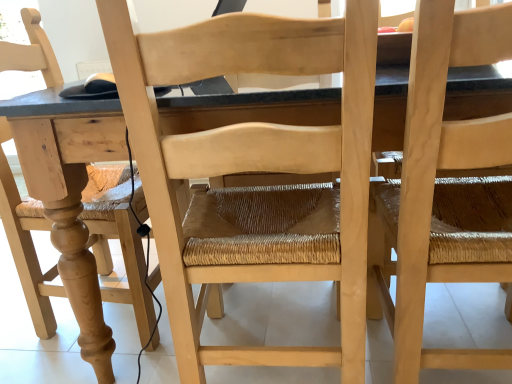
Question: Does natural wood table at center appear on the left side of natural wood chair at right, which is counted as the 2th chair, starting from the left?

Choices:
 (A) no
 (B) yes

Answer: (B)

Question: Is natural wood table at center with natural wood chair at right, which is counted as the 2th chair, starting from the left?

Choices:
 (A) no
 (B) yes

Answer: (A)

Question: From the image's perspective, is natural wood table at center located beneath natural wood chair at right, positioned as the first chair in right-to-left order?

Choices:
 (A) yes
 (B) no

Answer: (B)

Question: Is natural wood chair at right, positioned as the first chair in right-to-left order, located within natural wood table at center?

Choices:
 (A) no
 (B) yes

Answer: (B)

Question: Considering the relative sizes of natural wood table at center and natural wood chair at right, which is counted as the 2th chair, starting from the left, in the image provided, is natural wood table at center wider than natural wood chair at right, which is counted as the 2th chair, starting from the left,?

Choices:
 (A) yes
 (B) no

Answer: (A)

Question: Is natural wood chair at right, positioned as the first chair in right-to-left order, spatially inside natural wood table at center, or outside of it?

Choices:
 (A) inside
 (B) outside

Answer: (A)

Question: In terms of width, does natural wood chair at right, which is counted as the 2th chair, starting from the left, look wider or thinner when compared to natural wood table at center?

Choices:
 (A) wide
 (B) thin

Answer: (B)

Question: From the image's perspective, is natural wood chair at right, which is counted as the 2th chair, starting from the left, above or below natural wood table at center?

Choices:
 (A) below
 (B) above

Answer: (A)

Question: Is point (480, 264) positioned closer to the camera than point (373, 135)?

Choices:
 (A) closer
 (B) farther

Answer: (B)

Question: From the image's perspective, is natural wood table at center positioned above or below natural wood chair at center, the first chair viewed from the left?

Choices:
 (A) above
 (B) below

Answer: (A)

Question: In terms of height, does natural wood table at center look taller or shorter compared to natural wood chair at center, the first chair viewed from the left?

Choices:
 (A) short
 (B) tall

Answer: (A)

Question: Visually, is natural wood table at center positioned to the left or to the right of natural wood chair at center, which is the 2th chair from right to left?

Choices:
 (A) right
 (B) left

Answer: (A)

Question: Considering the positions of natural wood table at center and natural wood chair at center, which is the 2th chair from right to left, in the image, is natural wood table at center wider or thinner than natural wood chair at center, which is the 2th chair from right to left,?

Choices:
 (A) thin
 (B) wide

Answer: (B)

Question: Is natural wood chair at center, the first chair viewed from the left, to the left or to the right of natural wood table at center in the image?

Choices:
 (A) right
 (B) left

Answer: (B)

Question: In the image, is natural wood chair at center, which is the 2th chair from right to left, positioned in front of or behind natural wood table at center?

Choices:
 (A) behind
 (B) front

Answer: (B)